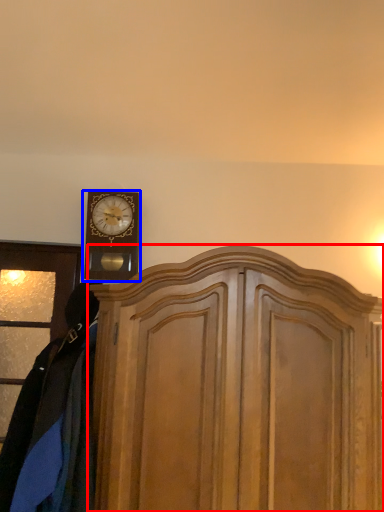
Question: Which object appears farthest to the camera in this image, dresser (highlighted by a red box) or wall clock (highlighted by a blue box)?

Choices:
 (A) dresser
 (B) wall clock

Answer: (B)